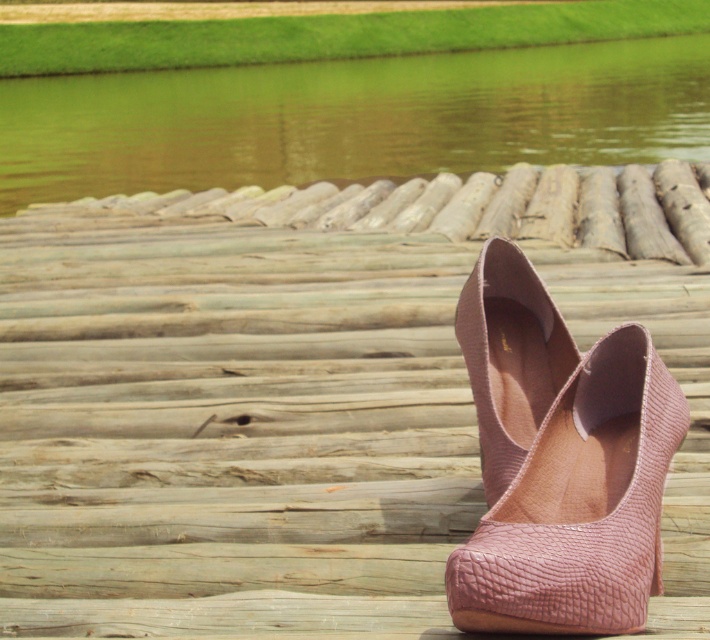
Is pink snakeskin high-heeled shoe at center above wooden log at center?

Incorrect, pink snakeskin high-heeled shoe at center is not positioned above wooden log at center.

Between pink snakeskin high-heeled shoe at center and wooden log at center, which one has more height?

wooden log at center

You are a GUI agent. You are given a task and a screenshot of the screen. Output one action in this format:
    pyautogui.click(x=<x>, y=<y>)
    Task: Click on the pink snakeskin high-heeled shoe at center
    The width and height of the screenshot is (710, 640).
    Given the screenshot: What is the action you would take?
    pyautogui.click(x=559, y=461)

Locate an element on the screen. The width and height of the screenshot is (710, 640). pink snakeskin high-heeled shoe at center is located at coordinates coord(559,461).

Is pink textured shoes at center to the right of pink snakeskin high-heeled shoe at center from the viewer's perspective?

No, pink textured shoes at center is not to the right of pink snakeskin high-heeled shoe at center.

Does pink textured shoes at center lie in front of pink snakeskin high-heeled shoe at center?

No.

Does point (687, 563) come closer to viewer compared to point (481, 433)?

Yes, point (687, 563) is in front of point (481, 433).

The height and width of the screenshot is (640, 710). What are the coordinates of `pink textured shoes at center` in the screenshot? It's located at (244, 410).

Measure the distance between pink textured shoes at center and wooden log at center.

The distance of pink textured shoes at center from wooden log at center is 1.52 meters.

The image size is (710, 640). Describe the element at coordinates (244, 410) in the screenshot. I see `pink textured shoes at center` at that location.

Find the location of a particular element. The image size is (710, 640). pink textured shoes at center is located at coordinates coord(244,410).